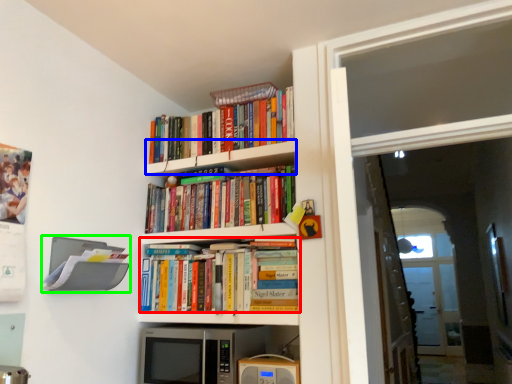
Question: Estimate the real-world distances between objects in this image. Which object is closer to book (highlighted by a red box), shelf (highlighted by a blue box) or shelf (highlighted by a green box)?

Choices:
 (A) shelf
 (B) shelf

Answer: (B)